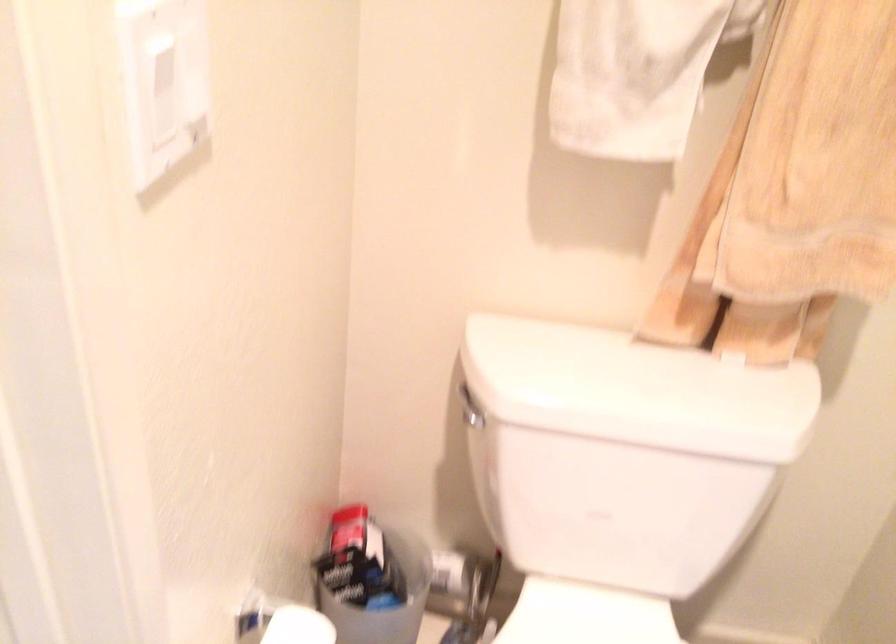
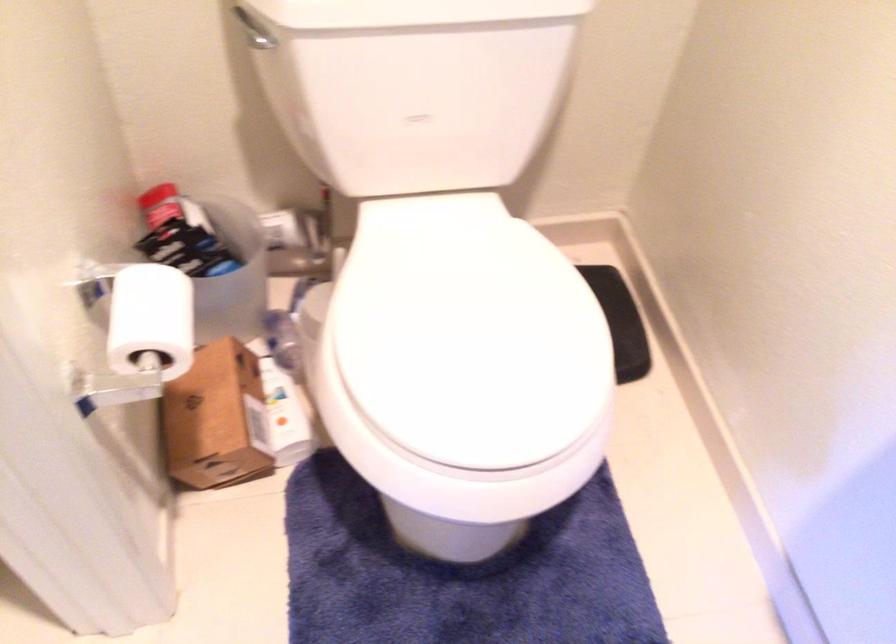
Where in the second image is the point corresponding to (x=599, y=500) from the first image?

(418, 104)